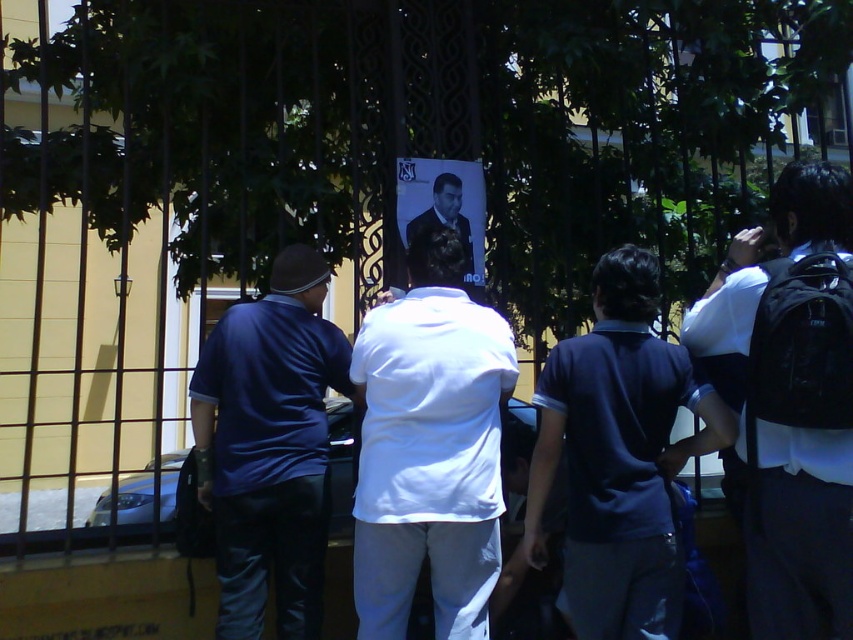
You are a photographer trying to capture a clear shot of the poster on the gate. You notice two people in the foreground wearing a white matte shirt at center and a matte blue shirt at center. Which person is blocking more of the poster?

The matte blue shirt at center is blocking more of the poster because it occupies more space than the white matte shirt at center.

You are a photographer trying to capture a clear photo of the poster on the gate. You notice two people in the foreground wearing a white matte shirt at center and a dark blue shirt at center. Which person is blocking more of the poster due to their width?

The dark blue shirt at center is blocking more of the poster because it has a greater width compared to the white matte shirt at center.

Consider the image. You are a photographer trying to capture a clear shot of the poster on the gate. There are two people in the way, a white matte shirt at center and a matte blue shirt at center. Which person do you need to ask to move so that you can see the poster better?

The white matte shirt at center is to the right of the matte blue shirt at center, so you should ask the matte blue shirt at center to move since they are closer to the center where the poster is located.